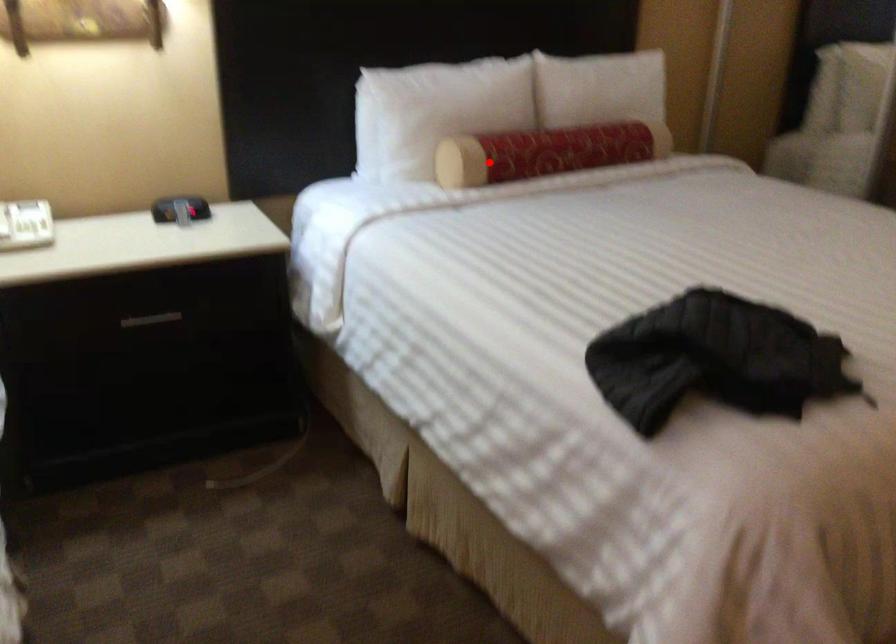
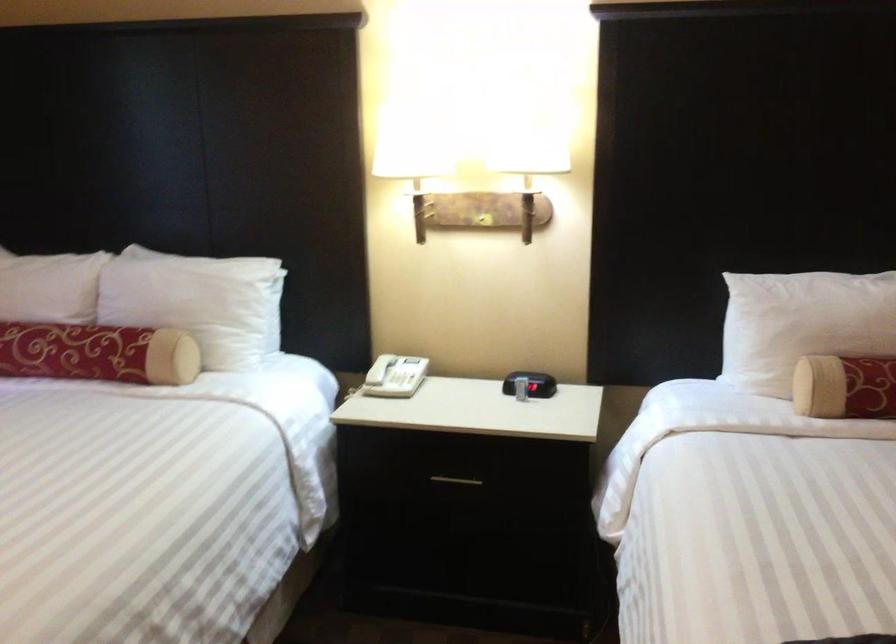
Question: I am providing you with two images of the same scene from different viewpoints. Image1 has a red point marked. In image2, the corresponding 3D location appears at what relative position? Reply with the corresponding letter.

Choices:
 (A) Closer
 (B) Farther

Answer: (A)